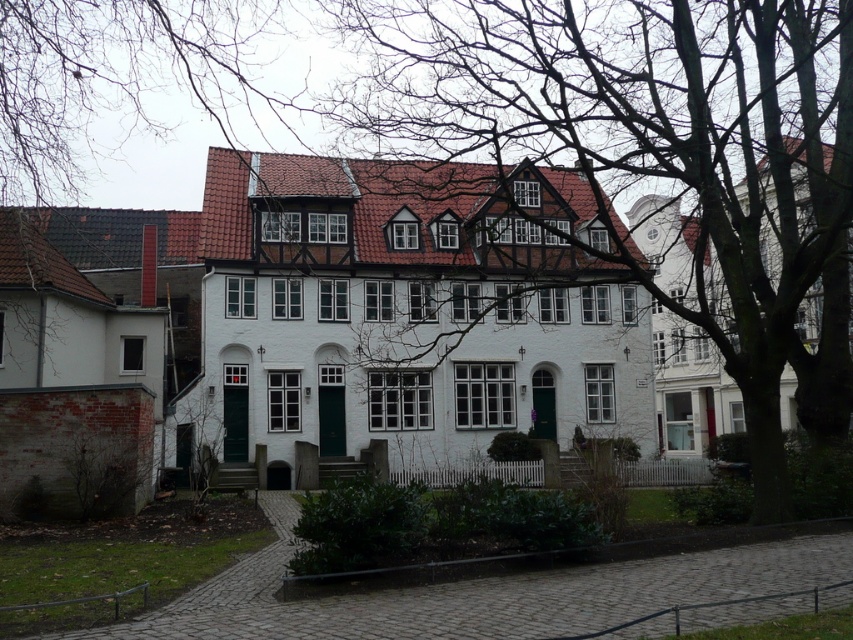
Question: In this image, where is smooth bark tree at center located relative to bare branches at upper left?

Choices:
 (A) below
 (B) above

Answer: (A)

Question: Among these objects, which one is nearest to the camera?

Choices:
 (A) bare branches at upper left
 (B) smooth bark tree at center

Answer: (B)

Question: From the image, what is the correct spatial relationship of smooth bark tree at center in relation to bare branches at upper left?

Choices:
 (A) below
 (B) above

Answer: (A)

Question: Which of the following is the closest to the observer?

Choices:
 (A) (525, 49)
 (B) (202, 67)

Answer: (A)

Question: Which of the following is the farthest from the observer?

Choices:
 (A) smooth bark tree at center
 (B) bare branches at upper left

Answer: (B)

Question: Can you confirm if smooth bark tree at center is positioned to the right of bare branches at upper left?

Choices:
 (A) yes
 (B) no

Answer: (A)